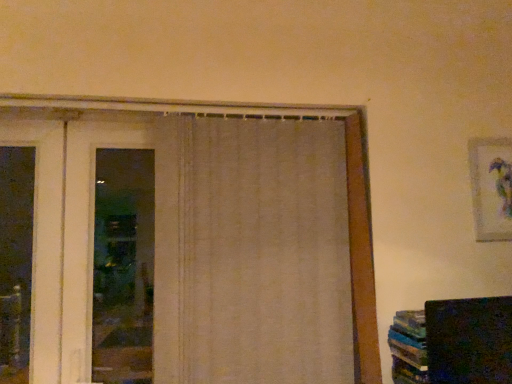
I want to click on white fabric door at left, so click(x=44, y=239).

This screenshot has height=384, width=512. Identify the location of beige fabric curtain at center. (251, 253).

Where is `white fabric door at left`? white fabric door at left is located at coordinates (44, 239).

From the image's perspective, which one is positioned lower, beige fabric curtain at center or matte white picture frame at upper right?

beige fabric curtain at center is shown below in the image.

How different are the orientations of beige fabric curtain at center and matte white picture frame at upper right in degrees?

0.999 degrees separate the facing orientations of beige fabric curtain at center and matte white picture frame at upper right.

Does beige fabric curtain at center have a greater height compared to matte white picture frame at upper right?

Yes, beige fabric curtain at center is taller than matte white picture frame at upper right.

Is beige fabric curtain at center aimed at matte white picture frame at upper right?

No, beige fabric curtain at center is not oriented towards matte white picture frame at upper right.

Is white fabric door at left positioned before matte white picture frame at upper right?

Yes, white fabric door at left is in front of matte white picture frame at upper right.

Between white fabric door at left and matte white picture frame at upper right, which one has more height?

Standing taller between the two is white fabric door at left.

From the image's perspective, who appears lower, white fabric door at left or matte white picture frame at upper right?

white fabric door at left appears lower in the image.

Does point (225, 141) lie in front of point (48, 317)?

No, it is behind (48, 317).

Based on the photo, who is taller, beige fabric curtain at center or white fabric door at left?

With more height is beige fabric curtain at center.

Can you confirm if beige fabric curtain at center is wider than white fabric door at left?

Correct, the width of beige fabric curtain at center exceeds that of white fabric door at left.

Can you tell me how much white fabric door at left and beige fabric curtain at center differ in facing direction?

They differ by 0.182 degrees in their facing directions.

Is white fabric door at left wider than beige fabric curtain at center?

No.

Would you say white fabric door at left is a long distance from beige fabric curtain at center?

white fabric door at left is near beige fabric curtain at center, not far away.

Which is more to the left, white fabric door at left or beige fabric curtain at center?

white fabric door at left is more to the left.

From a real-world perspective, between matte white picture frame at upper right and white fabric door at left, who is vertically lower?

From a 3D spatial view, white fabric door at left is below.

Locate an element on the screen. picture frame located above the white fabric door at left (from the image's perspective) is located at coordinates (490, 187).

Is matte white picture frame at upper right not close to white fabric door at left?

Yes.

From the image's perspective, which one is positioned higher, matte white picture frame at upper right or white fabric door at left?

From the image's view, matte white picture frame at upper right is above.

In order to click on curtain that is under the matte white picture frame at upper right (from a real-world perspective) in this screenshot , I will do `click(251, 253)`.

Could you tell me if matte white picture frame at upper right is turned towards beige fabric curtain at center?

No, matte white picture frame at upper right is not facing towards beige fabric curtain at center.

Considering the sizes of objects matte white picture frame at upper right and beige fabric curtain at center in the image provided, who is smaller, matte white picture frame at upper right or beige fabric curtain at center?

With smaller size is matte white picture frame at upper right.

Are matte white picture frame at upper right and beige fabric curtain at center far apart?

Actually, matte white picture frame at upper right and beige fabric curtain at center are a little close together.

At what (x,y) coordinates should I click in order to perform the action: click on picture frame located above the beige fabric curtain at center (from a real-world perspective). Please return your answer as a coordinate pair (x, y). This screenshot has width=512, height=384. Looking at the image, I should click on (490, 187).

Locate an element on the screen. The width and height of the screenshot is (512, 384). picture frame that is on the right side of white fabric door at left is located at coordinates (490, 187).

Which object lies further to the anchor point white fabric door at left, beige fabric curtain at center or matte white picture frame at upper right?

matte white picture frame at upper right lies further to white fabric door at left than the other object.

From the image, which object appears to be farther from beige fabric curtain at center, white fabric door at left or matte white picture frame at upper right?

Among the two, matte white picture frame at upper right is located further to beige fabric curtain at center.

Which object lies further to the anchor point matte white picture frame at upper right, white fabric door at left or beige fabric curtain at center?

Based on the image, white fabric door at left appears to be further to matte white picture frame at upper right.

Based on their spatial positions, is matte white picture frame at upper right or white fabric door at left closer to beige fabric curtain at center?

The object closer to beige fabric curtain at center is white fabric door at left.

In the scene shown: When comparing their distances from matte white picture frame at upper right, does beige fabric curtain at center or white fabric door at left seem closer?

beige fabric curtain at center lies closer to matte white picture frame at upper right than the other object.

Which object lies nearer to the anchor point white fabric door at left, matte white picture frame at upper right or beige fabric curtain at center?

beige fabric curtain at center lies closer to white fabric door at left than the other object.

Find the location of a particular element. curtain located between white fabric door at left and matte white picture frame at upper right in the left-right direction is located at coordinates (251, 253).